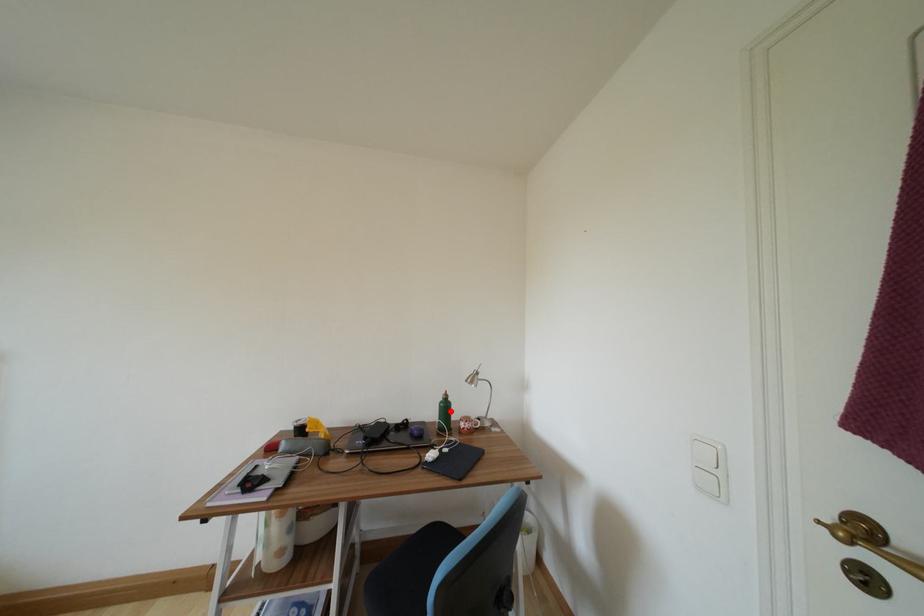
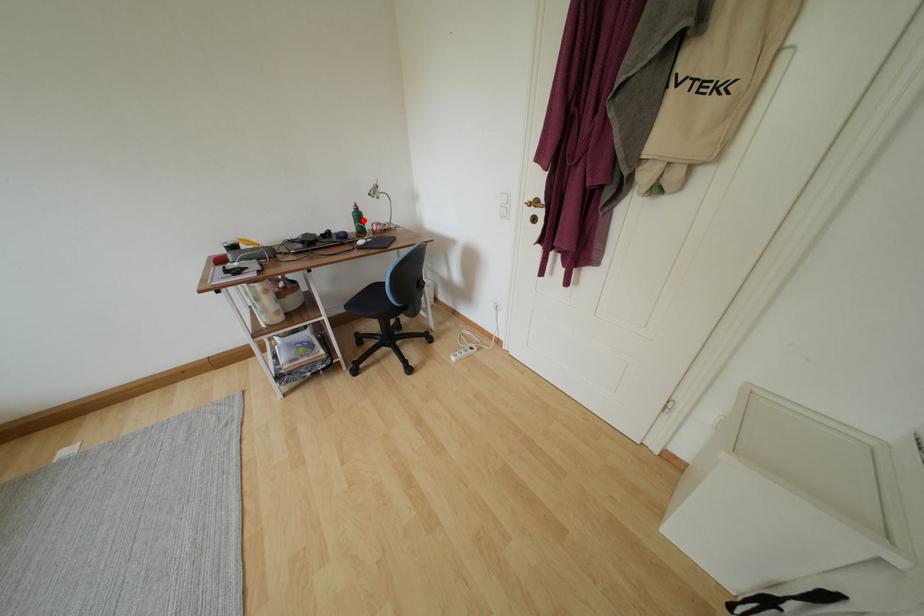
I am providing you with two images of the same scene from different viewpoints. A red point is marked on the first image and another point is marked on the second image. Is the marked point in image1 the same physical position as the marked point in image2?

Yes